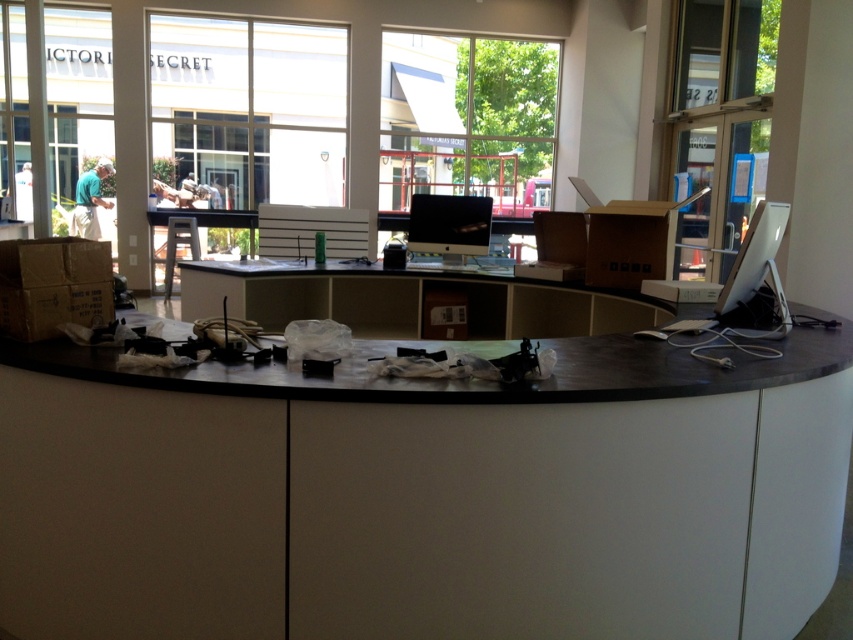
Question: Is matte black desk at center below satin silver monitor at right?

Choices:
 (A) no
 (B) yes

Answer: (B)

Question: Observing the image, what is the correct spatial positioning of sleek black monitor at center in reference to satin silver monitor at right?

Choices:
 (A) left
 (B) right

Answer: (A)

Question: Which object is closer to the camera taking this photo?

Choices:
 (A) matte black desk at center
 (B) sleek black monitor at center
 (C) satin silver monitor at right

Answer: (C)

Question: Which point is closer to the camera?

Choices:
 (A) black matte desk at center
 (B) sleek black monitor at center

Answer: (A)

Question: Is black matte desk at center positioned in front of sleek black monitor at center?

Choices:
 (A) yes
 (B) no

Answer: (A)

Question: Which point appears farthest from the camera in this image?

Choices:
 (A) (653, 304)
 (B) (474, 221)

Answer: (B)